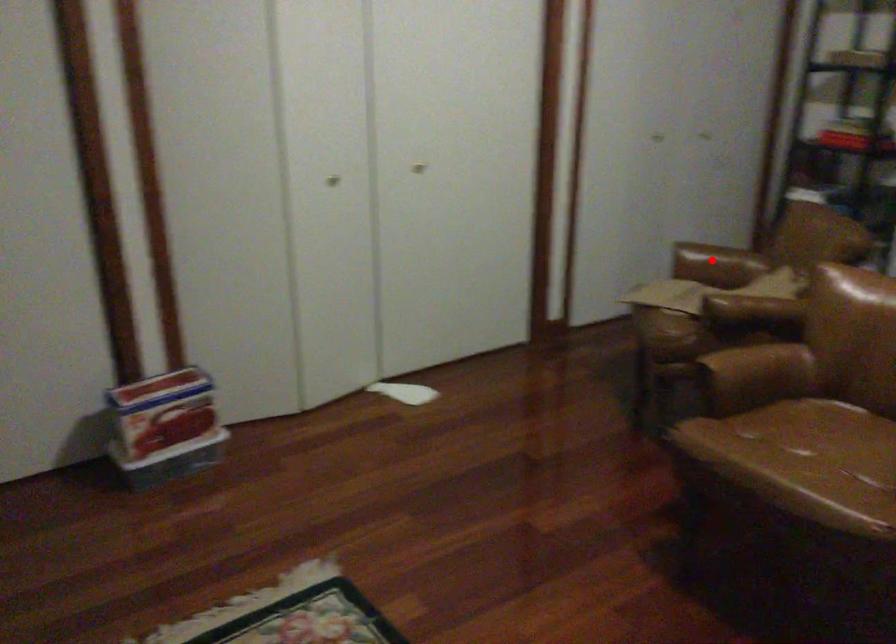
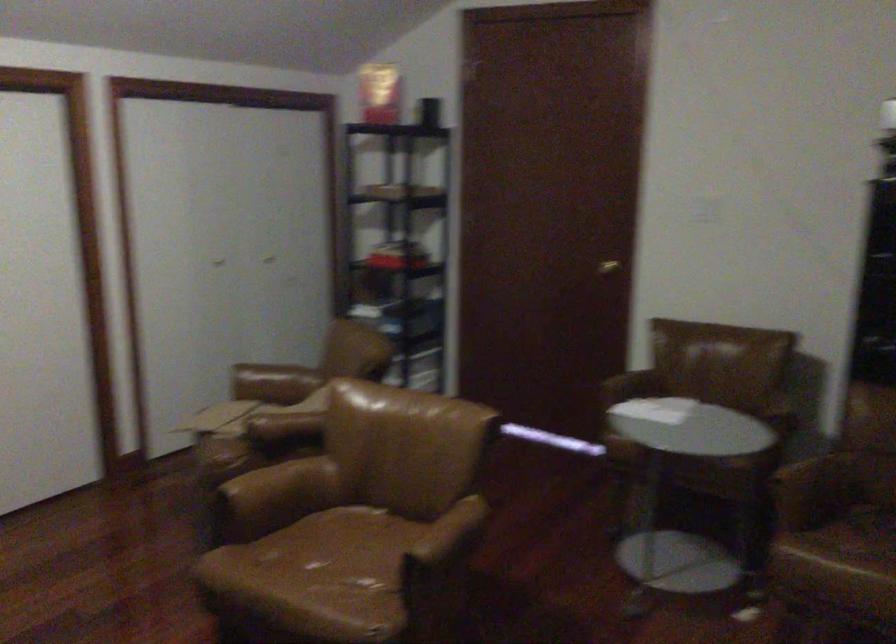
The point at the highlighted location is marked in the first image. Where is the corresponding point in the second image?

(273, 383)